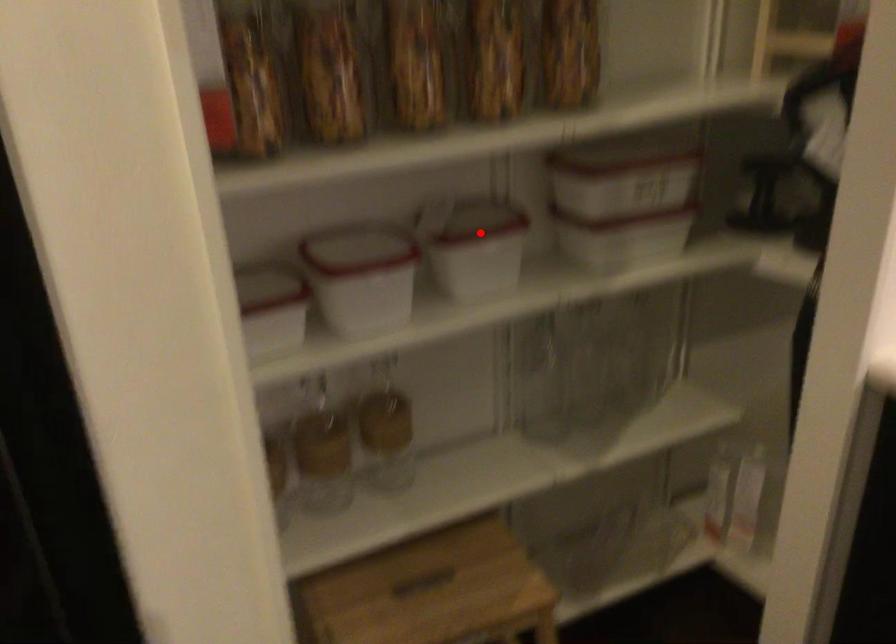
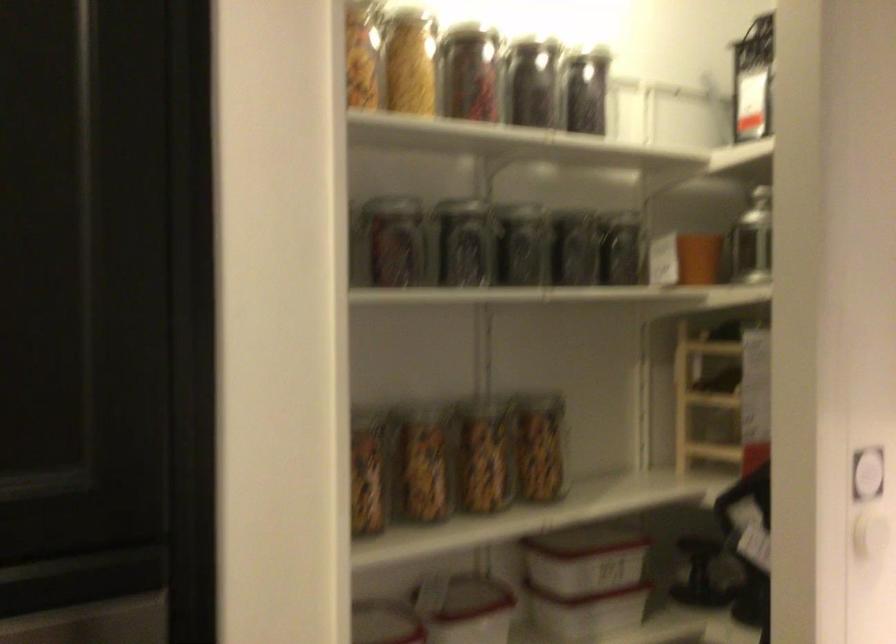
The point at the highlighted location is marked in the first image. Where is the corresponding point in the second image?

(464, 605)